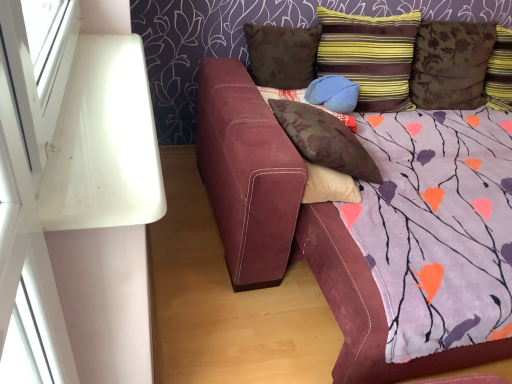
Question: Choose the correct answer: Is brown suede pillow at upper center, the 5th pillow viewed from the right, inside striped velvet pillow at upper right, placed as the 2th pillow when sorted from right to left, or outside it?

Choices:
 (A) outside
 (B) inside

Answer: (A)

Question: Is point (254, 26) closer or farther from the camera than point (398, 109)?

Choices:
 (A) closer
 (B) farther

Answer: (A)

Question: Which object is positioned closest to the brown suede pillow at upper center, the 5th pillow viewed from the right?

Choices:
 (A) striped velvet pillow at upper right, placed as the 2th pillow when sorted from right to left
 (B) suede couch at center
 (C) brown suede pillow at center, acting as the fourth pillow starting from the right
 (D) floral fabric pillow at upper right, acting as the 5th pillow starting from the left
 (E) blue suede pillow at upper center, which ranks as the 3th pillow in right-to-left order

Answer: (E)

Question: Estimate the real-world distances between objects in this image. Which object is closer to the brown suede pillow at center, acting as the fourth pillow starting from the right?

Choices:
 (A) floral fabric pillow at upper right, the first pillow viewed from the right
 (B) suede couch at center
 (C) striped velvet pillow at upper right, marked as the 4th pillow in a left-to-right arrangement
 (D) blue suede pillow at upper center, which ranks as the third pillow in left-to-right order
 (E) brown suede pillow at upper center, the 5th pillow viewed from the right

Answer: (B)